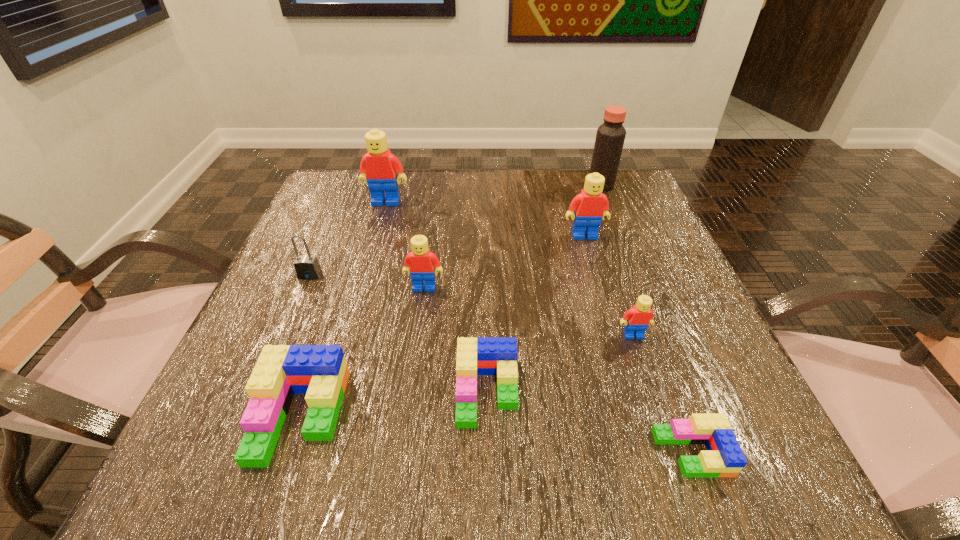
Where is `the smallest red Lego`? The image size is (960, 540). the smallest red Lego is located at coordinates (637, 319).

Find the location of `the fourth farthest Lego`. the fourth farthest Lego is located at coordinates (637, 319).

Find the location of a particular element. The width and height of the screenshot is (960, 540). the leftmost green Lego is located at coordinates (320, 371).

What are the coordinates of `the seventh tallest object` in the screenshot? It's located at (320, 371).

Find the location of a particular element. the sixth tallest Lego is located at coordinates (475, 356).

Find the location of `the second biggest green Lego`. the second biggest green Lego is located at coordinates (475, 356).

Where is `the shortest object`? The width and height of the screenshot is (960, 540). the shortest object is located at coordinates (724, 457).

Find the location of `the shortest Lego`. the shortest Lego is located at coordinates (724, 457).

Where is `free space located 0.320m on the left of the brown vinegar`? free space located 0.320m on the left of the brown vinegar is located at coordinates (462, 185).

You are a GUI agent. You are given a task and a screenshot of the screen. Output one action in this format:
    pyautogui.click(x=<x>, y=<y>)
    Task: Click on the free space located 0.260m on the face of the farthest red Lego
    This screenshot has width=960, height=540.
    Given the screenshot: What is the action you would take?
    pyautogui.click(x=363, y=282)